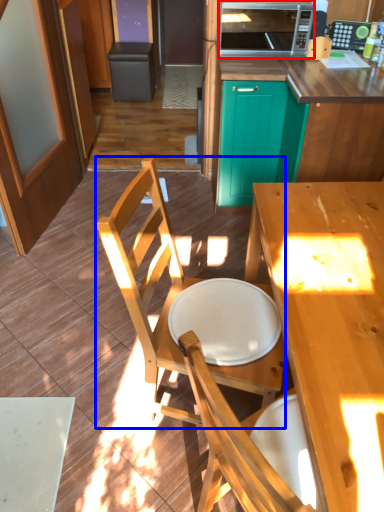
Question: Which point is closer to the camera, microwave oven (highlighted by a red box) or chair (highlighted by a blue box)?

Choices:
 (A) microwave oven
 (B) chair

Answer: (B)